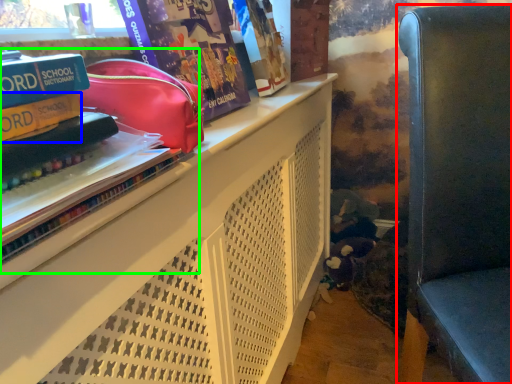
Question: Estimate the real-world distances between objects in this image. Which object is farther from furniture (highlighted by a red box), paperback book (highlighted by a blue box) or book (highlighted by a green box)?

Choices:
 (A) paperback book
 (B) book

Answer: (A)